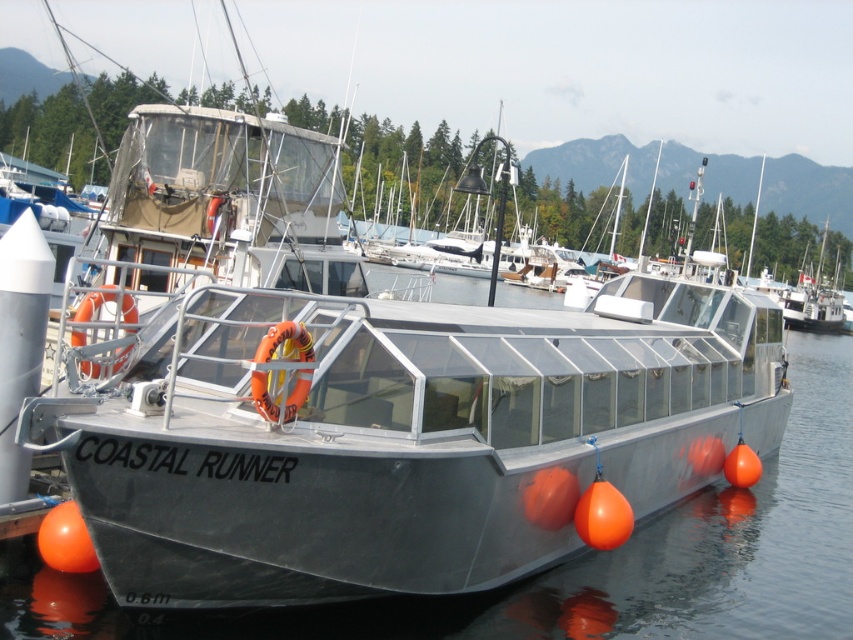
Between orange rubber life jacket at center and orange rubber life jacket at left, which one has more height?

orange rubber life jacket at left

Does point (299, 404) lie behind point (132, 308)?

No, (299, 404) is in front of (132, 308).

Locate an element on the screen. Image resolution: width=853 pixels, height=640 pixels. orange rubber life jacket at center is located at coordinates (283, 340).